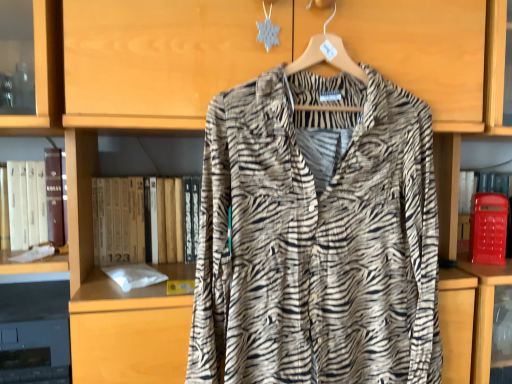
Question: Is white paper at left, the 2th book viewed from the right, shorter than hardcover book at center, positioned as the first book in right-to-left order?

Choices:
 (A) no
 (B) yes

Answer: (B)

Question: Does white paper at left, the 2th book viewed from the right, come behind hardcover book at center, the second book when ordered from left to right?

Choices:
 (A) yes
 (B) no

Answer: (B)

Question: Is white paper at left, placed as the 1th book when sorted from left to right, to the right of hardcover book at center, positioned as the first book in right-to-left order, from the viewer's perspective?

Choices:
 (A) no
 (B) yes

Answer: (A)

Question: Does white paper at left, the 2th book viewed from the right, have a lesser width compared to hardcover book at center, positioned as the first book in right-to-left order?

Choices:
 (A) no
 (B) yes

Answer: (B)

Question: Can you confirm if white paper at left, placed as the 1th book when sorted from left to right, is bigger than hardcover book at center, positioned as the first book in right-to-left order?

Choices:
 (A) yes
 (B) no

Answer: (B)

Question: Looking at their shapes, would you say matte red phone box at right is wider or thinner than hardcover book at center, positioned as the first book in right-to-left order?

Choices:
 (A) wide
 (B) thin

Answer: (B)

Question: Is matte red phone box at right bigger or smaller than hardcover book at center, positioned as the first book in right-to-left order?

Choices:
 (A) big
 (B) small

Answer: (B)

Question: Considering the positions of matte red phone box at right and hardcover book at center, positioned as the first book in right-to-left order, in the image, is matte red phone box at right taller or shorter than hardcover book at center, positioned as the first book in right-to-left order,?

Choices:
 (A) short
 (B) tall

Answer: (A)

Question: Relative to hardcover book at center, positioned as the first book in right-to-left order, is matte red phone box at right in front or behind?

Choices:
 (A) front
 (B) behind

Answer: (B)

Question: Looking at their shapes, would you say white paper at left, placed as the 1th book when sorted from left to right, is wider or thinner than zebra-patterned fabric shirt at center?

Choices:
 (A) wide
 (B) thin

Answer: (B)

Question: From their relative heights in the image, would you say white paper at left, placed as the 1th book when sorted from left to right, is taller or shorter than zebra-patterned fabric shirt at center?

Choices:
 (A) tall
 (B) short

Answer: (B)

Question: From the image's perspective, is white paper at left, the 2th book viewed from the right, positioned above or below zebra-patterned fabric shirt at center?

Choices:
 (A) above
 (B) below

Answer: (B)

Question: Based on their positions, is white paper at left, the 2th book viewed from the right, located to the left or right of zebra-patterned fabric shirt at center?

Choices:
 (A) right
 (B) left

Answer: (B)

Question: From the image's perspective, is hardcover book at center, positioned as the first book in right-to-left order, positioned above or below zebra-patterned fabric shirt at center?

Choices:
 (A) below
 (B) above

Answer: (A)

Question: Looking at the image, does hardcover book at center, the second book when ordered from left to right, seem bigger or smaller compared to zebra-patterned fabric shirt at center?

Choices:
 (A) big
 (B) small

Answer: (B)